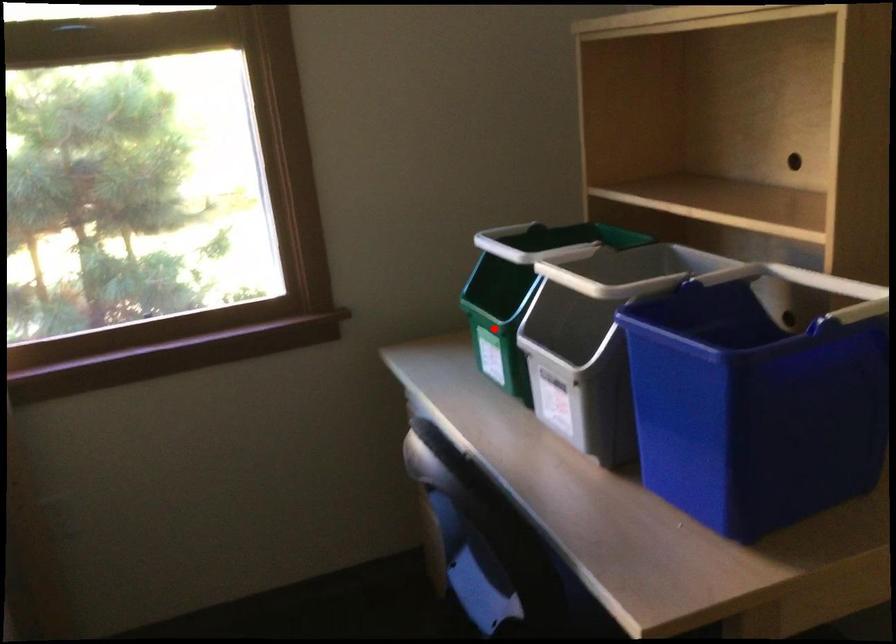
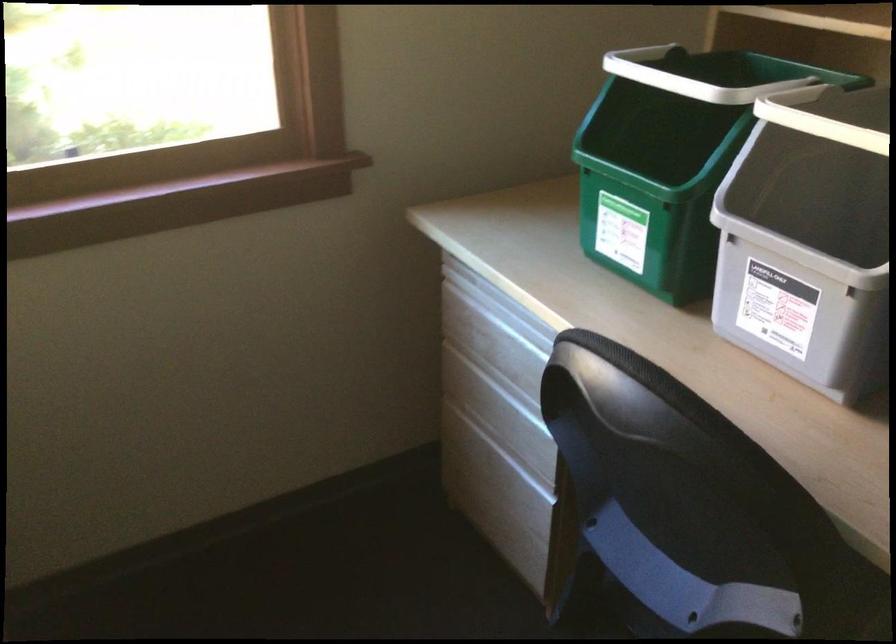
Question: I am providing you with two images of the same scene from different viewpoints. Given a red point in image1, look at the same physical point in image2. Is it:

Choices:
 (A) Closer to the viewpoint
 (B) Farther from the viewpoint

Answer: (A)